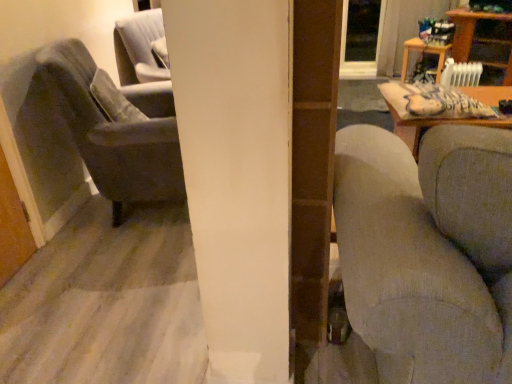
Question: Can you confirm if wooden table at upper right, placed as the first table when sorted from right to left, is shorter than transparent glass door at upper center?

Choices:
 (A) no
 (B) yes

Answer: (B)

Question: Does wooden table at upper right, the second table viewed from the left, have a smaller size compared to transparent glass door at upper center?

Choices:
 (A) no
 (B) yes

Answer: (A)

Question: Does wooden table at upper right, the second table viewed from the left, have a greater width compared to transparent glass door at upper center?

Choices:
 (A) no
 (B) yes

Answer: (B)

Question: From a real-world perspective, does wooden table at upper right, the second table viewed from the left, sit lower than transparent glass door at upper center?

Choices:
 (A) no
 (B) yes

Answer: (B)

Question: Is wooden table at upper right, the second table viewed from the left, facing away from transparent glass door at upper center?

Choices:
 (A) no
 (B) yes

Answer: (A)

Question: From the image's perspective, is wooden table at upper right, the second table viewed from the left, beneath transparent glass door at upper center?

Choices:
 (A) yes
 (B) no

Answer: (A)

Question: From a real-world perspective, is textured gray couch at right on top of wooden table at upper right, acting as the 1th table starting from the left?

Choices:
 (A) no
 (B) yes

Answer: (B)

Question: Is wooden table at upper right, the second table when ordered from right to left, a part of textured gray couch at right?

Choices:
 (A) yes
 (B) no

Answer: (B)

Question: Can you confirm if textured gray couch at right is shorter than wooden table at upper right, acting as the 1th table starting from the left?

Choices:
 (A) yes
 (B) no

Answer: (B)

Question: Does textured gray couch at right come behind wooden table at upper right, acting as the 1th table starting from the left?

Choices:
 (A) yes
 (B) no

Answer: (B)

Question: Considering the relative positions of textured gray couch at right and wooden table at upper right, acting as the 1th table starting from the left, in the image provided, is textured gray couch at right to the right of wooden table at upper right, acting as the 1th table starting from the left, from the viewer's perspective?

Choices:
 (A) no
 (B) yes

Answer: (A)

Question: Is the depth of textured gray couch at right less than that of wooden table at upper right, the second table when ordered from right to left?

Choices:
 (A) yes
 (B) no

Answer: (A)

Question: From a real-world perspective, is wooden table at upper right, the second table viewed from the left, on wooden table at upper right, acting as the 1th table starting from the left?

Choices:
 (A) no
 (B) yes

Answer: (B)